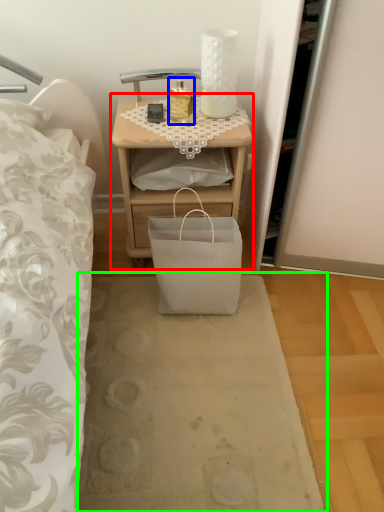
Question: Considering the real-world distances, which object is farthest from nightstand (highlighted by a red box)? bottle (highlighted by a blue box) or plain (highlighted by a green box)?

Choices:
 (A) bottle
 (B) plain

Answer: (B)